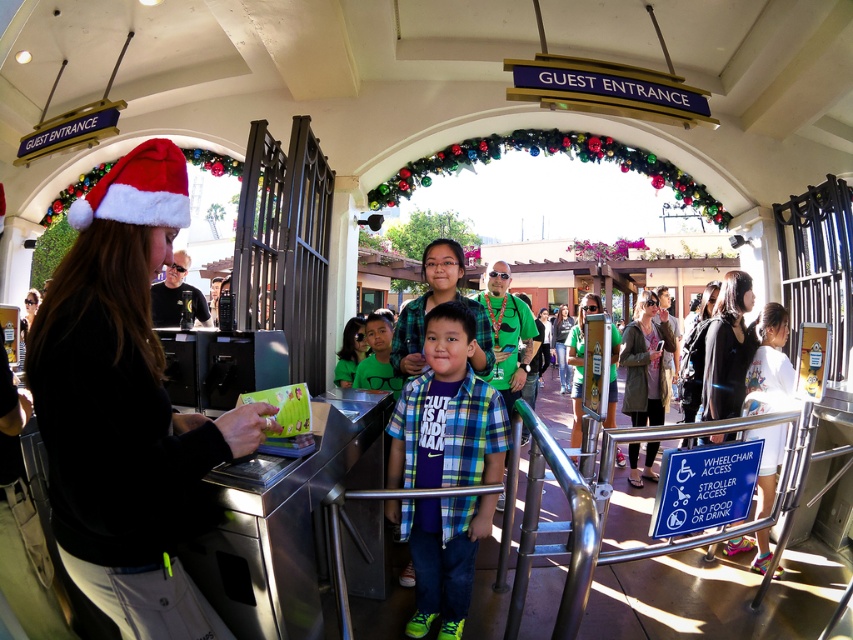
Identify the location of santa hat at center. The height and width of the screenshot is (640, 853). (125, 406).

Between point (91, 476) and point (398, 401), which one is positioned behind?

Positioned behind is point (398, 401).

Who is more distant from viewer, (200,298) or (469,428)?

Positioned behind is point (200,298).

This screenshot has height=640, width=853. I want to click on santa hat at center, so click(x=125, y=406).